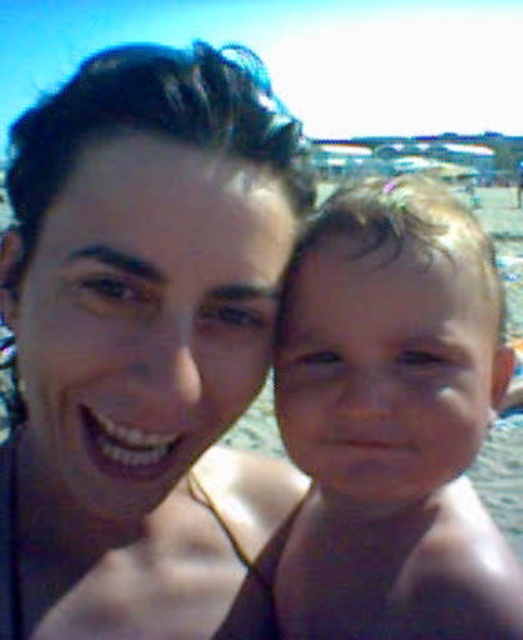
Question: Based on their relative distances, which object is nearer to the matte black hair at center?

Choices:
 (A) smooth skin baby at center
 (B) clear blue water at baby right

Answer: (A)

Question: Which object is farther from the camera taking this photo?

Choices:
 (A) smooth skin baby at center
 (B) clear blue water at baby right

Answer: (B)

Question: Is matte black hair at center closer to the viewer compared to clear blue water at baby right?

Choices:
 (A) no
 (B) yes

Answer: (B)

Question: Does smooth skin baby at center have a lesser width compared to clear blue water at baby right?

Choices:
 (A) no
 (B) yes

Answer: (B)

Question: Which of the following is the closest to the observer?

Choices:
 (A) clear blue water at baby right
 (B) matte black hair at center

Answer: (B)

Question: From the image, what is the correct spatial relationship of matte black hair at center in relation to smooth skin baby at center?

Choices:
 (A) above
 (B) below

Answer: (A)